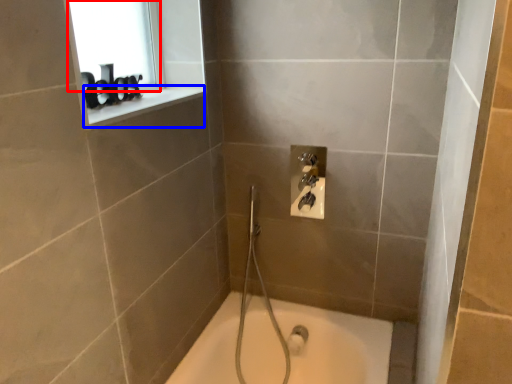
Question: Which of the following is the closest to the observer, window screen (highlighted by a red box) or window sill (highlighted by a blue box)?

Choices:
 (A) window screen
 (B) window sill

Answer: (B)